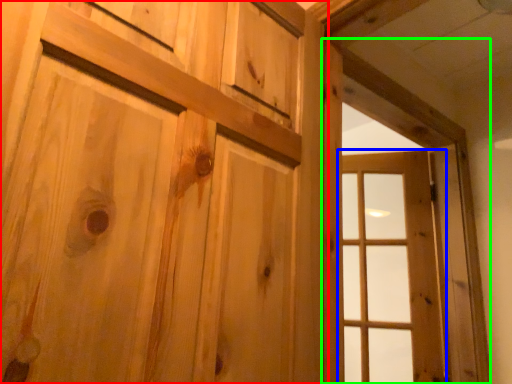
Question: Considering the real-world distances, which object is closest to door (highlighted by a red box)? window (highlighted by a blue box) or window frame (highlighted by a green box).

Choices:
 (A) window
 (B) window frame

Answer: (B)